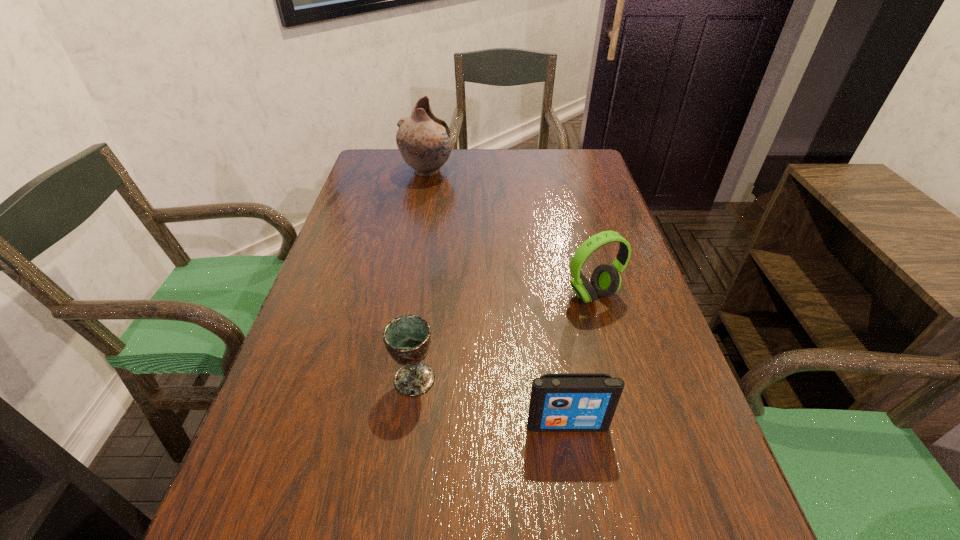
Where is `the farthest object`? the farthest object is located at coordinates (424, 140).

Identify the location of pottery. (424, 140).

Identify the location of the third nearest object. Image resolution: width=960 pixels, height=540 pixels. (605, 280).

At what (x,y) coordinates should I click in order to perform the action: click on the third shortest object. Please return your answer as a coordinate pair (x, y). Looking at the image, I should click on (605, 280).

At what (x,y) coordinates should I click in order to perform the action: click on chalice. Please return your answer as a coordinate pair (x, y). Looking at the image, I should click on (407, 338).

I want to click on iPod, so click(560, 402).

This screenshot has height=540, width=960. I want to click on free location located from the spout of the pottery, so click(516, 171).

Find the location of a particular element. This screenshot has width=960, height=540. vacant region located on the left of the headset is located at coordinates (510, 295).

At what (x,y) coordinates should I click in order to perform the action: click on vacant position located on the right of the chalice. Please return your answer as a coordinate pair (x, y). The image size is (960, 540). Looking at the image, I should click on (622, 379).

The width and height of the screenshot is (960, 540). In order to click on free region located on the front screen of the nearest object in this screenshot , I will do `click(586, 537)`.